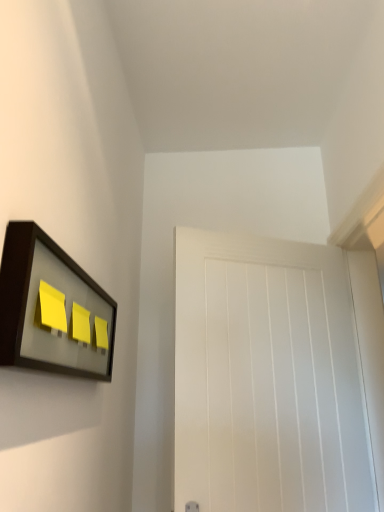
Question: Is matte black picture frame at upper left in front of white matte door at center?

Choices:
 (A) yes
 (B) no

Answer: (A)

Question: Would you consider matte black picture frame at upper left to be distant from white matte door at center?

Choices:
 (A) no
 (B) yes

Answer: (A)

Question: From the image's perspective, is matte black picture frame at upper left on top of white matte door at center?

Choices:
 (A) yes
 (B) no

Answer: (A)

Question: From a real-world perspective, is matte black picture frame at upper left below white matte door at center?

Choices:
 (A) no
 (B) yes

Answer: (A)

Question: From the image's perspective, is matte black picture frame at upper left under white matte door at center?

Choices:
 (A) yes
 (B) no

Answer: (B)

Question: Does matte black picture frame at upper left come behind white matte door at center?

Choices:
 (A) no
 (B) yes

Answer: (A)

Question: Can you confirm if white matte door at center is positioned to the left of matte black picture frame at upper left?

Choices:
 (A) yes
 (B) no

Answer: (B)

Question: Is white matte door at center wider than matte black picture frame at upper left?

Choices:
 (A) yes
 (B) no

Answer: (A)

Question: Is white matte door at center touching matte black picture frame at upper left?

Choices:
 (A) yes
 (B) no

Answer: (B)

Question: Are white matte door at center and matte black picture frame at upper left far apart?

Choices:
 (A) no
 (B) yes

Answer: (A)

Question: Could you tell me if white matte door at center is facing matte black picture frame at upper left?

Choices:
 (A) no
 (B) yes

Answer: (A)

Question: Is matte black picture frame at upper left completely or partially inside white matte door at center?

Choices:
 (A) yes
 (B) no

Answer: (B)

Question: Looking at the image, does matte black picture frame at upper left seem bigger or smaller compared to white matte door at center?

Choices:
 (A) big
 (B) small

Answer: (B)